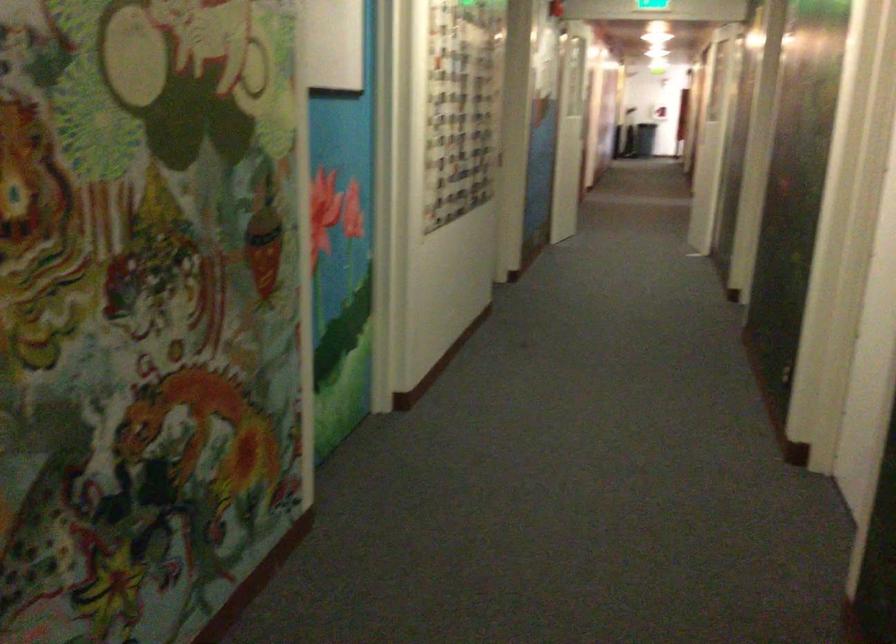
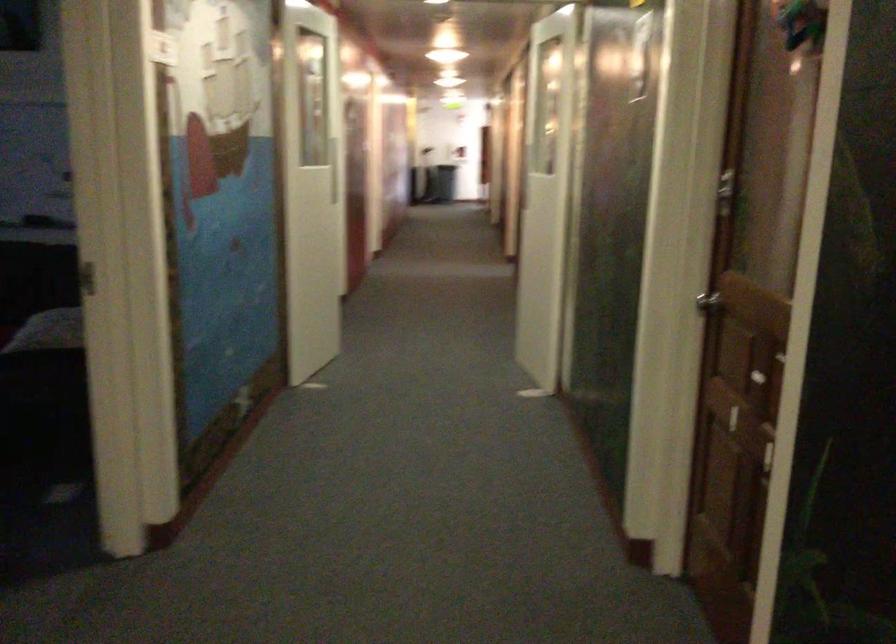
Question: The images are taken continuously from a first-person perspective. In which direction are you moving?

Choices:
 (A) Left
 (B) Right
 (C) Forward
 (D) Backward

Answer: (C)